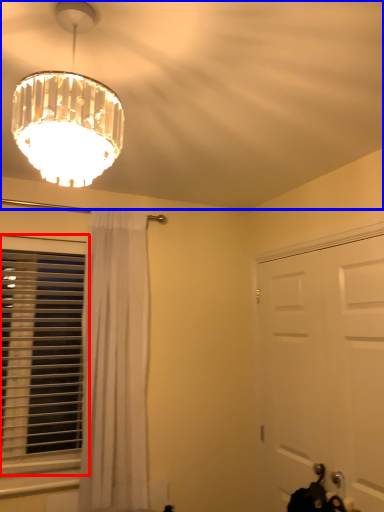
Question: Which object appears farthest to the camera in this image, window (highlighted by a red box) or fan (highlighted by a blue box)?

Choices:
 (A) window
 (B) fan

Answer: (A)